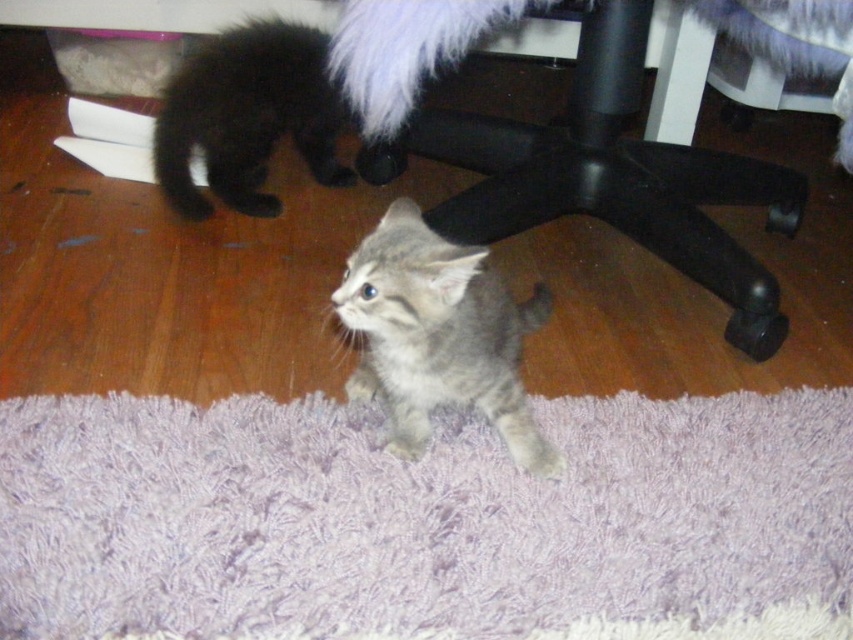
Question: Does black plastic computer chair at lower center appear on the left side of gray tabby kitten at center?

Choices:
 (A) yes
 (B) no

Answer: (B)

Question: Which of the following is the closest to the observer?

Choices:
 (A) purple shaggy rug at center
 (B) fluffy black kitten at upper left
 (C) black plastic computer chair at lower center
 (D) gray tabby kitten at center

Answer: (A)

Question: Is black plastic computer chair at lower center smaller than fluffy black kitten at upper left?

Choices:
 (A) yes
 (B) no

Answer: (B)

Question: Which object appears closest to the camera in this image?

Choices:
 (A) gray tabby kitten at center
 (B) fluffy black kitten at upper left

Answer: (A)

Question: Estimate the real-world distances between objects in this image. Which object is farther from the gray tabby kitten at center?

Choices:
 (A) purple shaggy rug at center
 (B) fluffy black kitten at upper left
 (C) black plastic computer chair at lower center

Answer: (B)

Question: Can you confirm if purple shaggy rug at center is wider than gray tabby kitten at center?

Choices:
 (A) no
 (B) yes

Answer: (B)